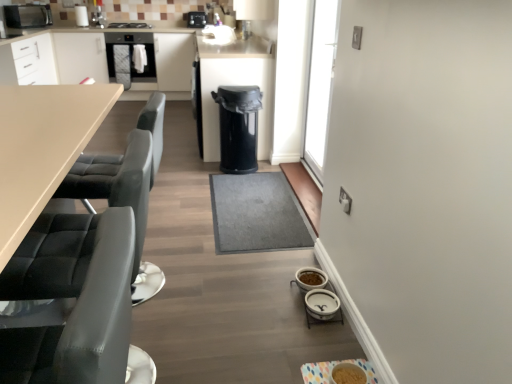
You are a GUI agent. You are given a task and a screenshot of the screen. Output one action in this format:
    pyautogui.click(x=<x>, y=<y>)
    Task: Click on the free space behind white ceramic bowls at lower right, the second appliance positioned from the bottom
    The height and width of the screenshot is (384, 512).
    Given the screenshot: What is the action you would take?
    pyautogui.click(x=291, y=266)